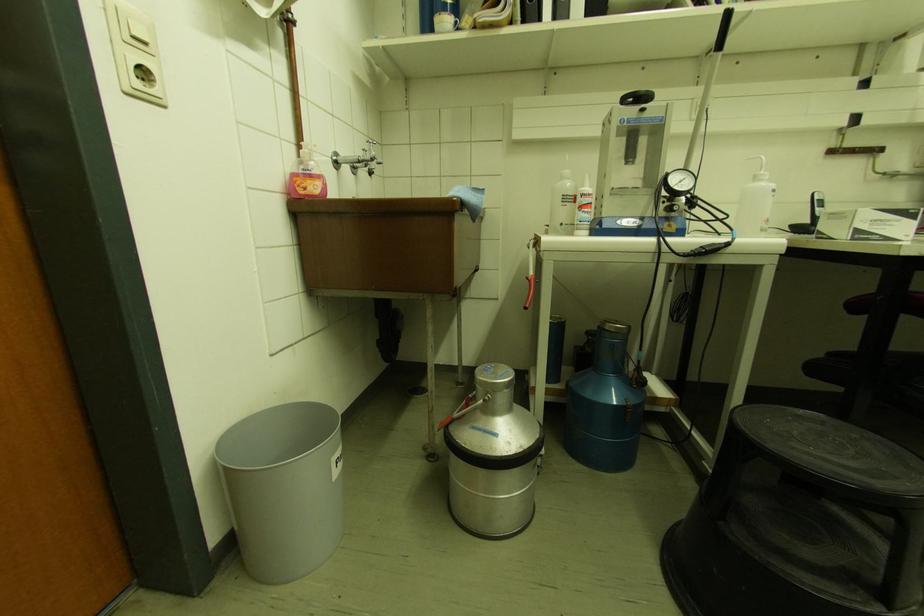
Identify the location of white light switch. click(x=135, y=29).